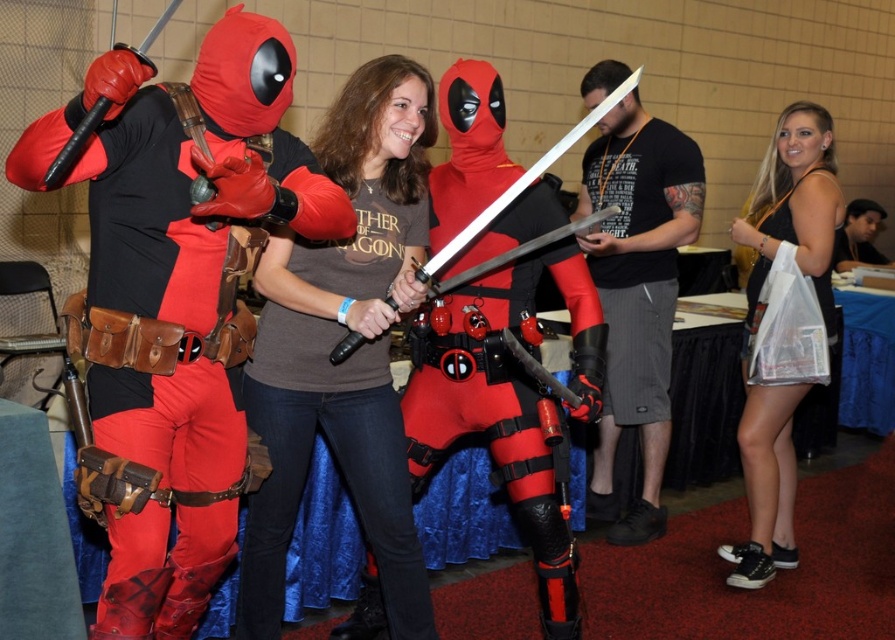
Between matte red costume at left and matte black sword at center, which one has more height?

With more height is matte black sword at center.

This screenshot has width=895, height=640. What do you see at coordinates (177, 342) in the screenshot?
I see `matte red costume at left` at bounding box center [177, 342].

Where is `matte red costume at left`? matte red costume at left is located at coordinates (177, 342).

Does point (154, 104) lie behind point (455, 248)?

No, (154, 104) is in front of (455, 248).

Looking at this image, is matte red costume at left wider than shiny silver sword at center?

No.

Where is `matte red costume at left`? This screenshot has width=895, height=640. matte red costume at left is located at coordinates (177, 342).

Between matte black tank top at center and matte black sword at center, which one is positioned lower?

Positioned lower is matte black tank top at center.

Does matte black tank top at center have a larger size compared to matte black sword at center?

Correct, matte black tank top at center is larger in size than matte black sword at center.

Which is in front, point (746, 326) or point (672, 134)?

Point (746, 326) is in front.

The image size is (895, 640). I want to click on matte black tank top at center, so click(x=763, y=317).